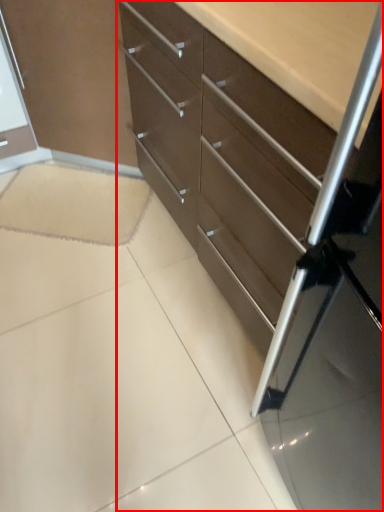
Question: Where is chest of drawers (annotated by the red box) located in relation to ceramic tile in the image?

Choices:
 (A) right
 (B) left

Answer: (A)